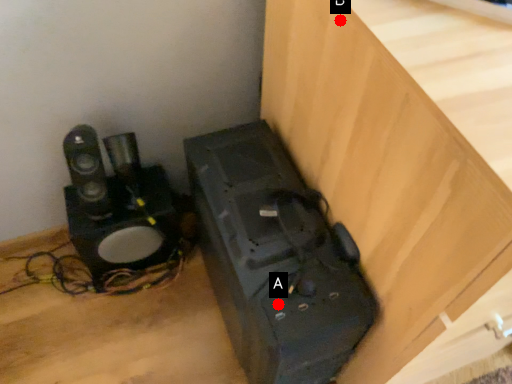
Question: Two points are circled on the image, labeled by A and B beside each circle. Which point appears closest to the camera in this image?

Choices:
 (A) A is closer
 (B) B is closer

Answer: (B)